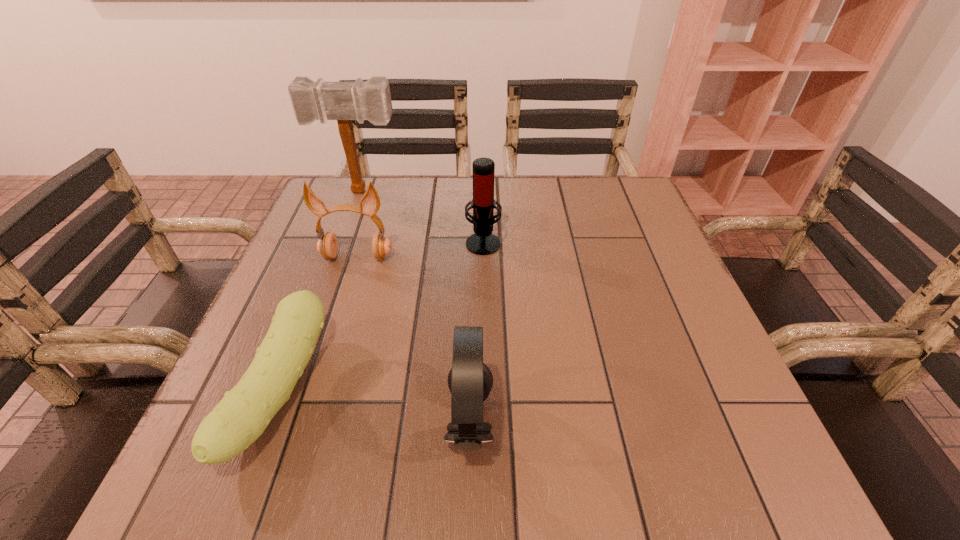
At what (x,y) coordinates should I click in order to perform the action: click on free spot located 0.330m on the right of the cucumber. Please return your answer as a coordinate pair (x, y). The height and width of the screenshot is (540, 960). Looking at the image, I should click on pyautogui.click(x=515, y=393).

What are the coordinates of `object located at the far edge` in the screenshot? It's located at (343, 101).

Find the location of a particular element. This screenshot has width=960, height=540. earphone located at the near edge is located at coordinates (470, 381).

Identify the location of cucumber present at the near edge. Image resolution: width=960 pixels, height=540 pixels. (239, 419).

This screenshot has width=960, height=540. What are the coordinates of `mallet that is at the left edge` in the screenshot? It's located at (343, 101).

Where is `earphone situated at the left edge`? earphone situated at the left edge is located at coordinates (327, 245).

The height and width of the screenshot is (540, 960). What are the coordinates of `cucumber that is at the left edge` in the screenshot? It's located at (239, 419).

Locate an element on the screen. The height and width of the screenshot is (540, 960). object located in the far left corner section of the desktop is located at coordinates tap(343, 101).

Where is `object situated at the near left corner`? The height and width of the screenshot is (540, 960). object situated at the near left corner is located at coordinates (239, 419).

Where is `free space at the near edge`? free space at the near edge is located at coordinates (324, 477).